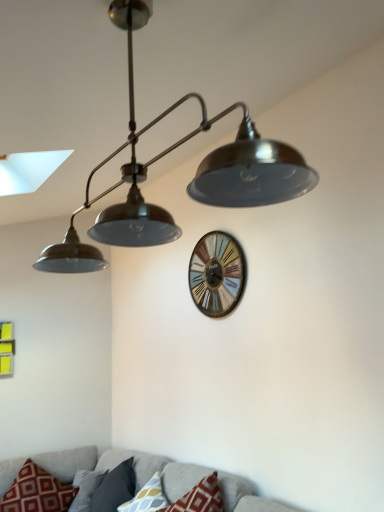
What do you see at coordinates (115, 488) in the screenshot? The width and height of the screenshot is (384, 512). I see `gray fabric pillow at lower center, which is counted as the 2th pillow, starting from the left` at bounding box center [115, 488].

Find the location of a particular element. This screenshot has width=384, height=512. gray fabric pillow at lower center, which is counted as the 2th pillow, starting from the left is located at coordinates (115, 488).

Describe the element at coordinates (122, 461) in the screenshot. The width and height of the screenshot is (384, 512). I see `textured gray couch at lower center` at that location.

You are a GUI agent. You are given a task and a screenshot of the screen. Output one action in this format:
    pyautogui.click(x=<x>, y=<y>)
    Task: Click on the red printed cushion at lower left, the third pillow viewed from the right
    
    Given the screenshot: What is the action you would take?
    pyautogui.click(x=37, y=492)

Locate an element on the screen. This screenshot has height=512, width=384. wooden wall clock at center is located at coordinates (217, 274).

This screenshot has height=512, width=384. Describe the element at coordinates (217, 274) in the screenshot. I see `wooden wall clock at center` at that location.

You are a GUI agent. You are given a task and a screenshot of the screen. Output one action in this format:
    pyautogui.click(x=<x>, y=<y>)
    Task: Click on the gray fabric pillow at lower center, which is counted as the 2th pillow, starting from the left
    
    Given the screenshot: What is the action you would take?
    pyautogui.click(x=115, y=488)

From the image's perspective, which one is positioned higher, gray fabric pillow at lower center, which is counted as the 2th pillow, starting from the left, or patterned fabric pillow at lower center, placed as the 3th pillow when sorted from left to right?

patterned fabric pillow at lower center, placed as the 3th pillow when sorted from left to right, is shown above in the image.

From a real-world perspective, which is physically above, gray fabric pillow at lower center, which ranks as the 2th pillow in right-to-left order, or patterned fabric pillow at lower center, placed as the 3th pillow when sorted from left to right?

patterned fabric pillow at lower center, placed as the 3th pillow when sorted from left to right, from a real-world perspective.

Is gray fabric pillow at lower center, which ranks as the 2th pillow in right-to-left order, closer to camera compared to patterned fabric pillow at lower center, placed as the 3th pillow when sorted from left to right?

No, gray fabric pillow at lower center, which ranks as the 2th pillow in right-to-left order, is behind patterned fabric pillow at lower center, placed as the 3th pillow when sorted from left to right.

Which is more distant, (128, 488) or (128, 505)?

The point (128, 488) is behind.

Considering the sizes of objects red printed cushion at lower left, the 1th pillow in the left-to-right sequence, and patterned fabric pillow at lower center, placed as the 1th pillow when sorted from right to left, in the image provided, who is bigger, red printed cushion at lower left, the 1th pillow in the left-to-right sequence, or patterned fabric pillow at lower center, placed as the 1th pillow when sorted from right to left,?

With larger size is red printed cushion at lower left, the 1th pillow in the left-to-right sequence.

In the image, is red printed cushion at lower left, the third pillow viewed from the right, on the left side or the right side of patterned fabric pillow at lower center, placed as the 3th pillow when sorted from left to right?

red printed cushion at lower left, the third pillow viewed from the right, is positioned on patterned fabric pillow at lower center, placed as the 3th pillow when sorted from left to right,'s left side.

Looking at this image, considering the sizes of objects red printed cushion at lower left, the third pillow viewed from the right, and patterned fabric pillow at lower center, placed as the 1th pillow when sorted from right to left, in the image provided, who is wider, red printed cushion at lower left, the third pillow viewed from the right, or patterned fabric pillow at lower center, placed as the 1th pillow when sorted from right to left,?

red printed cushion at lower left, the third pillow viewed from the right, is wider.

Which object is further away from the camera, red printed cushion at lower left, the 1th pillow in the left-to-right sequence, or patterned fabric pillow at lower center, placed as the 3th pillow when sorted from left to right?

Positioned behind is red printed cushion at lower left, the 1th pillow in the left-to-right sequence.

From a real-world perspective, which object rests below the other?

In real-world perspective, textured gray couch at lower center is lower.

Between wooden wall clock at center and textured gray couch at lower center, which one is positioned in front?

Positioned in front is textured gray couch at lower center.

Which point is more distant from viewer, (236,242) or (182,473)?

Positioned behind is point (236,242).

I want to click on couch beneath the wooden wall clock at center (from a real-world perspective), so click(122, 461).

From the image's perspective, would you say wooden wall clock at center is shown under gray fabric pillow at lower center, which ranks as the 2th pillow in right-to-left order?

No.

From the picture: Can you confirm if wooden wall clock at center is thinner than gray fabric pillow at lower center, which ranks as the 2th pillow in right-to-left order?

Yes, wooden wall clock at center is thinner than gray fabric pillow at lower center, which ranks as the 2th pillow in right-to-left order.

Is wooden wall clock at center taller or shorter than gray fabric pillow at lower center, which ranks as the 2th pillow in right-to-left order?

Clearly, wooden wall clock at center is taller compared to gray fabric pillow at lower center, which ranks as the 2th pillow in right-to-left order.

From the picture: From the image's perspective, does patterned fabric pillow at lower center, placed as the 1th pillow when sorted from right to left, appear lower than textured gray couch at lower center?

No, from the image's perspective, patterned fabric pillow at lower center, placed as the 1th pillow when sorted from right to left, is not beneath textured gray couch at lower center.

From the picture: Is textured gray couch at lower center a part of patterned fabric pillow at lower center, placed as the 3th pillow when sorted from left to right?

That's incorrect, textured gray couch at lower center is not inside patterned fabric pillow at lower center, placed as the 3th pillow when sorted from left to right.

How different are the orientations of patterned fabric pillow at lower center, placed as the 1th pillow when sorted from right to left, and textured gray couch at lower center in degrees?

The facing directions of patterned fabric pillow at lower center, placed as the 1th pillow when sorted from right to left, and textured gray couch at lower center are 0.0483 degrees apart.

Is patterned fabric pillow at lower center, placed as the 1th pillow when sorted from right to left, aimed at textured gray couch at lower center?

Yes, patterned fabric pillow at lower center, placed as the 1th pillow when sorted from right to left, is oriented towards textured gray couch at lower center.

Would you say patterned fabric pillow at lower center, placed as the 3th pillow when sorted from left to right, contains gray fabric pillow at lower center, which ranks as the 2th pillow in right-to-left order?

No.

Is patterned fabric pillow at lower center, placed as the 1th pillow when sorted from right to left, in front of or behind gray fabric pillow at lower center, which is counted as the 2th pillow, starting from the left, in the image?

Visually, patterned fabric pillow at lower center, placed as the 1th pillow when sorted from right to left, is located in front of gray fabric pillow at lower center, which is counted as the 2th pillow, starting from the left.

In the scene shown: Between patterned fabric pillow at lower center, placed as the 3th pillow when sorted from left to right, and gray fabric pillow at lower center, which is counted as the 2th pillow, starting from the left, which one has larger width?

With larger width is gray fabric pillow at lower center, which is counted as the 2th pillow, starting from the left.

From a real-world perspective, who is located higher, patterned fabric pillow at lower center, placed as the 1th pillow when sorted from right to left, or gray fabric pillow at lower center, which is counted as the 2th pillow, starting from the left?

In real-world perspective, patterned fabric pillow at lower center, placed as the 1th pillow when sorted from right to left, is above.

Considering the relative sizes of gray fabric pillow at lower center, which is counted as the 2th pillow, starting from the left, and textured gray couch at lower center in the image provided, is gray fabric pillow at lower center, which is counted as the 2th pillow, starting from the left, shorter than textured gray couch at lower center?

Yes.

From the image's perspective, is gray fabric pillow at lower center, which ranks as the 2th pillow in right-to-left order, above or below textured gray couch at lower center?

Based on their image positions, gray fabric pillow at lower center, which ranks as the 2th pillow in right-to-left order, is located beneath textured gray couch at lower center.

Could you tell me if gray fabric pillow at lower center, which ranks as the 2th pillow in right-to-left order, is turned towards textured gray couch at lower center?

Yes, gray fabric pillow at lower center, which ranks as the 2th pillow in right-to-left order, is facing textured gray couch at lower center.

Where is `the 1st pillow to the left of the patterned fabric pillow at lower center, placed as the 3th pillow when sorted from left to right, starting your count from the anchor`? the 1st pillow to the left of the patterned fabric pillow at lower center, placed as the 3th pillow when sorted from left to right, starting your count from the anchor is located at coordinates (115, 488).

Find the location of `pillow located above the red printed cushion at lower left, the 1th pillow in the left-to-right sequence (from a real-world perspective)`. pillow located above the red printed cushion at lower left, the 1th pillow in the left-to-right sequence (from a real-world perspective) is located at coordinates [x=147, y=497].

From the image, which object appears to be nearer to textured gray couch at lower center, gray fabric pillow at lower center, which is counted as the 2th pillow, starting from the left, or red printed cushion at lower left, the third pillow viewed from the right?

gray fabric pillow at lower center, which is counted as the 2th pillow, starting from the left.

Based on their spatial positions, is red printed cushion at lower left, the third pillow viewed from the right, or gray fabric pillow at lower center, which is counted as the 2th pillow, starting from the left, closer to textured gray couch at lower center?

The object closer to textured gray couch at lower center is gray fabric pillow at lower center, which is counted as the 2th pillow, starting from the left.

Based on their spatial positions, is red printed cushion at lower left, the 1th pillow in the left-to-right sequence, or gray fabric pillow at lower center, which ranks as the 2th pillow in right-to-left order, closer to wooden wall clock at center?

The object closer to wooden wall clock at center is gray fabric pillow at lower center, which ranks as the 2th pillow in right-to-left order.

Looking at the image, which one is located further to red printed cushion at lower left, the third pillow viewed from the right, patterned fabric pillow at lower center, placed as the 3th pillow when sorted from left to right, or wooden wall clock at center?

wooden wall clock at center.

Based on their spatial positions, is gray fabric pillow at lower center, which ranks as the 2th pillow in right-to-left order, or wooden wall clock at center further from red printed cushion at lower left, the third pillow viewed from the right?

Based on the image, wooden wall clock at center appears to be further to red printed cushion at lower left, the third pillow viewed from the right.

Estimate the real-world distances between objects in this image. Which object is closer to wooden wall clock at center, patterned fabric pillow at lower center, placed as the 1th pillow when sorted from right to left, or gray fabric pillow at lower center, which ranks as the 2th pillow in right-to-left order?

Among the two, patterned fabric pillow at lower center, placed as the 1th pillow when sorted from right to left, is located nearer to wooden wall clock at center.

Looking at the image, which one is located closer to red printed cushion at lower left, the 1th pillow in the left-to-right sequence, textured gray couch at lower center or patterned fabric pillow at lower center, placed as the 3th pillow when sorted from left to right?

textured gray couch at lower center is closer to red printed cushion at lower left, the 1th pillow in the left-to-right sequence.

Considering their positions, is textured gray couch at lower center positioned further to patterned fabric pillow at lower center, placed as the 3th pillow when sorted from left to right, than gray fabric pillow at lower center, which ranks as the 2th pillow in right-to-left order?

Among the two, gray fabric pillow at lower center, which ranks as the 2th pillow in right-to-left order, is located further to patterned fabric pillow at lower center, placed as the 3th pillow when sorted from left to right.

Find the location of a particular element. The image size is (384, 512). pillow between textured gray couch at lower center and red printed cushion at lower left, the 1th pillow in the left-to-right sequence, along the z-axis is located at coordinates (147, 497).

Find the location of a particular element. pillow between wooden wall clock at center and textured gray couch at lower center in the up-down direction is located at coordinates (147, 497).

This screenshot has height=512, width=384. What are the coordinates of `pillow between wooden wall clock at center and gray fabric pillow at lower center, which is counted as the 2th pillow, starting from the left, in the up-down direction` in the screenshot? It's located at (147, 497).

This screenshot has width=384, height=512. Identify the location of wall clock between textured gray couch at lower center and gray fabric pillow at lower center, which ranks as the 2th pillow in right-to-left order, from front to back. (217, 274).